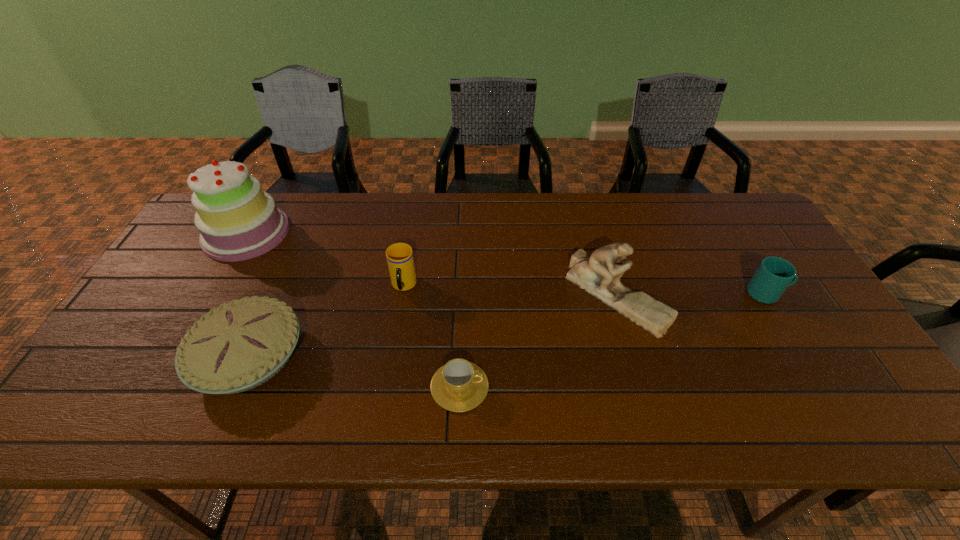
The image size is (960, 540). Find the location of `empty location between the tallest object and the fourth object from left to right`. empty location between the tallest object and the fourth object from left to right is located at coordinates (353, 309).

Locate an element on the screen. Image resolution: width=960 pixels, height=540 pixels. vacant area between the pie and the rightmost object is located at coordinates (508, 325).

Locate an element on the screen. free space between the tallest object and the fifth object from left to right is located at coordinates (431, 264).

Where is `vacant space that is in between the cake and the rightmost object`? Image resolution: width=960 pixels, height=540 pixels. vacant space that is in between the cake and the rightmost object is located at coordinates (507, 263).

Locate an element on the screen. free point between the cake and the figurine is located at coordinates tap(431, 264).

Locate an element on the screen. object that is the second closest to the second cup from right to left is located at coordinates (599, 275).

Identify the location of the closest object relative to the nearest cup. The height and width of the screenshot is (540, 960). (399, 256).

At what (x,y) coordinates should I click in order to perform the action: click on the closest cup relative to the pie. Please return your answer as a coordinate pair (x, y). The image size is (960, 540). Looking at the image, I should click on (399, 256).

Locate an element on the screen. The height and width of the screenshot is (540, 960). the third closest cup to the fifth object from left to right is located at coordinates (399, 256).

Find the location of a particular element. vacant area that satisfies the following two spatial constraints: 1. on the handle side of the rightmost object; 2. on the front-facing side of the second object from right to left is located at coordinates (768, 295).